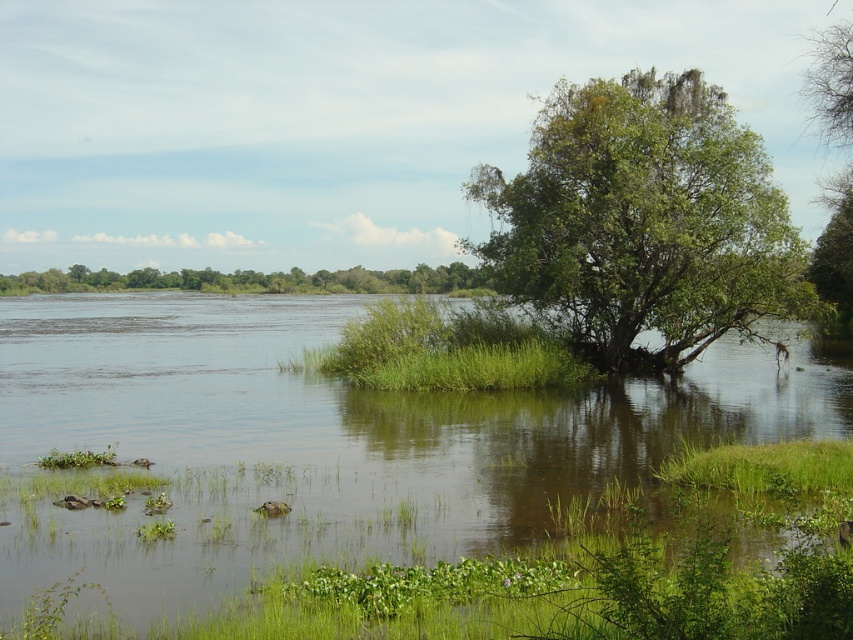
Image resolution: width=853 pixels, height=640 pixels. Find the location of `green grassy river at center`. green grassy river at center is located at coordinates (325, 444).

Is point (97, 419) in front of point (260, 282)?

Yes.

What do you see at coordinates (325, 444) in the screenshot? This screenshot has width=853, height=640. I see `green grassy river at center` at bounding box center [325, 444].

Identify the location of green grassy river at center. (325, 444).

Between green leafy tree at upper right and green leafy tree at center, which one has less height?

Standing shorter between the two is green leafy tree at center.

Describe the element at coordinates (643, 221) in the screenshot. I see `green leafy tree at upper right` at that location.

Measure the distance between green leafy tree at upper right and camera.

A distance of 34.05 meters exists between green leafy tree at upper right and camera.

Locate an element on the screen. Image resolution: width=853 pixels, height=640 pixels. green leafy tree at upper right is located at coordinates (643, 221).

Who is positioned more to the right, green grassy river at center or green leafy tree at upper right?

From the viewer's perspective, green leafy tree at upper right appears more on the right side.

Does green grassy river at center come behind green leafy tree at upper right?

No.

Locate an element on the screen. This screenshot has height=640, width=853. green grassy river at center is located at coordinates (325, 444).